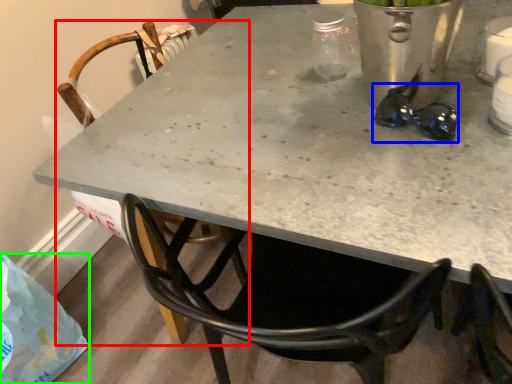
Question: Which object is the closest to the chair (highlighted by a red box)? Choose among these: glasses (highlighted by a blue box) or plastic bag (highlighted by a green box).

Choices:
 (A) glasses
 (B) plastic bag

Answer: (B)